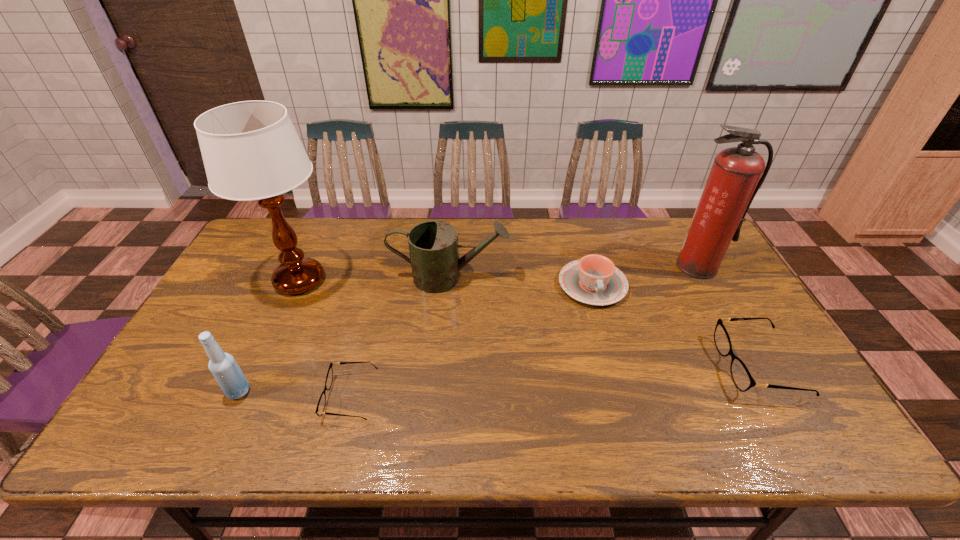
Locate an element on the screen. The height and width of the screenshot is (540, 960). vacant space located 0.070m on the back of the bottle is located at coordinates (253, 359).

Where is `table lamp present at the far edge`? The width and height of the screenshot is (960, 540). table lamp present at the far edge is located at coordinates (251, 151).

The width and height of the screenshot is (960, 540). Find the location of `fire extinguisher located at the far edge`. fire extinguisher located at the far edge is located at coordinates (736, 175).

At what (x,y) coordinates should I click in order to perform the action: click on bottle present at the near edge. Please return your answer as a coordinate pair (x, y). Looking at the image, I should click on (227, 373).

At what (x,y) coordinates should I click in order to perform the action: click on object that is at the left edge. Please return your answer as a coordinate pair (x, y). This screenshot has width=960, height=540. Looking at the image, I should click on (251, 151).

Locate an element on the screen. This screenshot has width=960, height=540. spectacles located at the right edge is located at coordinates (740, 374).

Find the location of `fire extinguisher situated at the right edge`. fire extinguisher situated at the right edge is located at coordinates (736, 175).

The height and width of the screenshot is (540, 960). I want to click on object that is at the far left corner, so click(x=251, y=151).

Locate an element on the screen. This screenshot has width=960, height=540. object present at the far right corner is located at coordinates (736, 175).

At what (x,y) coordinates should I click in order to perform the action: click on object that is at the near right corner. Please return your answer as a coordinate pair (x, y). Looking at the image, I should click on (740, 374).